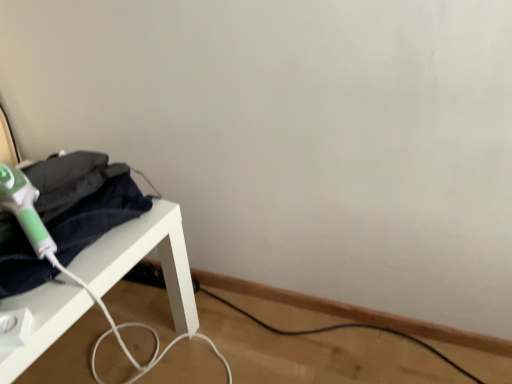
Question: Considering the positions of point (140, 220) and point (15, 175), is point (140, 220) closer or farther from the camera than point (15, 175)?

Choices:
 (A) closer
 (B) farther

Answer: (A)

Question: Is white plastic table at left wider or thinner than green plastic hair dryer at left?

Choices:
 (A) thin
 (B) wide

Answer: (B)

Question: In the image, is white plastic table at left on the left side or the right side of green plastic hair dryer at left?

Choices:
 (A) right
 (B) left

Answer: (B)

Question: Is green plastic hair dryer at left in front of or behind white plastic table at left in the image?

Choices:
 (A) front
 (B) behind

Answer: (B)

Question: Do you think green plastic hair dryer at left is within white plastic table at left, or outside of it?

Choices:
 (A) outside
 (B) inside

Answer: (A)

Question: In terms of height, does green plastic hair dryer at left look taller or shorter compared to white plastic table at left?

Choices:
 (A) short
 (B) tall

Answer: (A)

Question: From the image's perspective, is green plastic hair dryer at left positioned above or below white plastic table at left?

Choices:
 (A) below
 (B) above

Answer: (B)